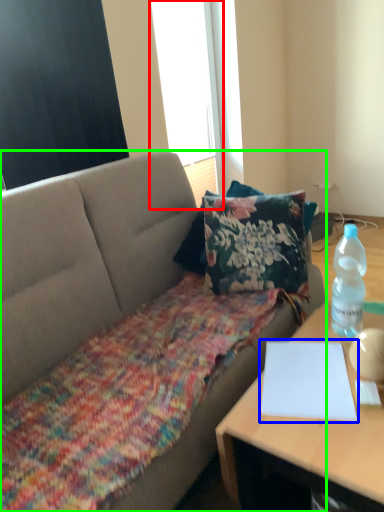
Question: Considering the real-world distances, which object is closest to window screen (highlighted by a red box)? notebook (highlighted by a blue box) or studio couch (highlighted by a green box).

Choices:
 (A) notebook
 (B) studio couch

Answer: (B)